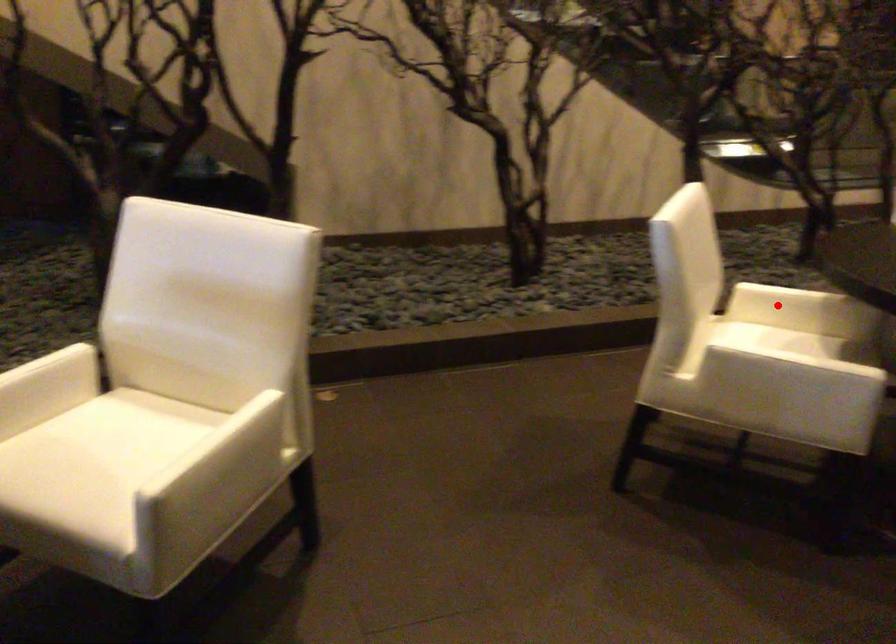
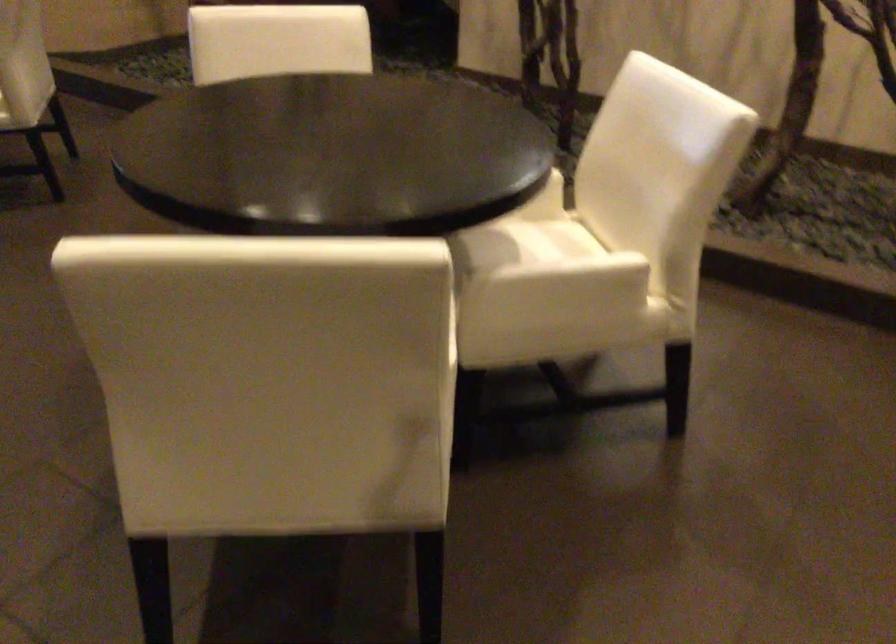
Question: I am providing you with two images of the same scene from different viewpoints. A red point is marked on the first image. At the location where the point appears in image 1, is it still visible in image 2?

Choices:
 (A) Yes
 (B) No

Answer: (B)